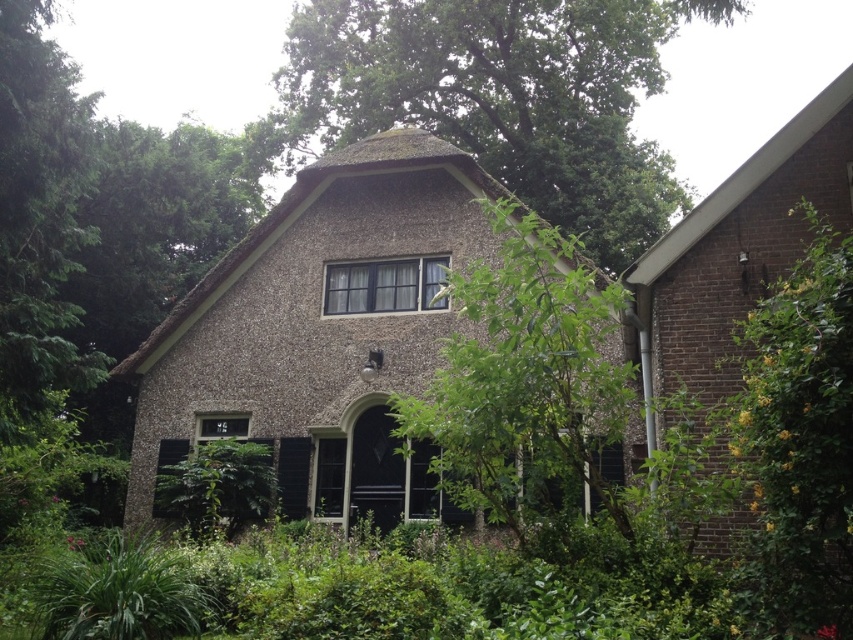
Question: Which of the following is the farthest from the observer?

Choices:
 (A) tap(636, 160)
 (B) tap(526, 369)

Answer: (A)

Question: Is green leafy tree at upper center wider than green leafy tree at center?

Choices:
 (A) no
 (B) yes

Answer: (B)

Question: Which of the following is the closest to the observer?

Choices:
 (A) (548, 134)
 (B) (589, 292)

Answer: (B)

Question: Which object is closer to the camera taking this photo?

Choices:
 (A) green leafy tree at upper center
 (B) green leafy tree at center

Answer: (A)

Question: Does green leafy tree at upper center appear under green leafy tree at center?

Choices:
 (A) no
 (B) yes

Answer: (A)

Question: Does green leafy tree at upper center appear on the left side of green leafy tree at center?

Choices:
 (A) no
 (B) yes

Answer: (A)